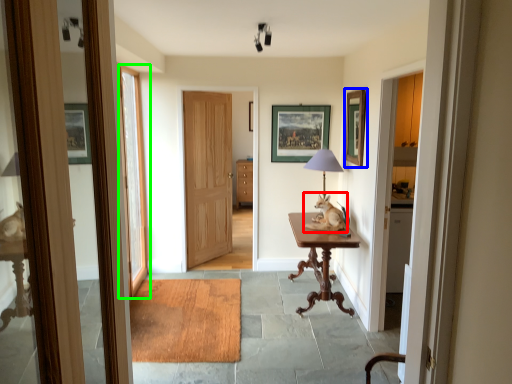
Question: Which is farther away from open (highlighted by a red box)? picture frame (highlighted by a blue box) or door (highlighted by a green box)?

Choices:
 (A) picture frame
 (B) door

Answer: (B)